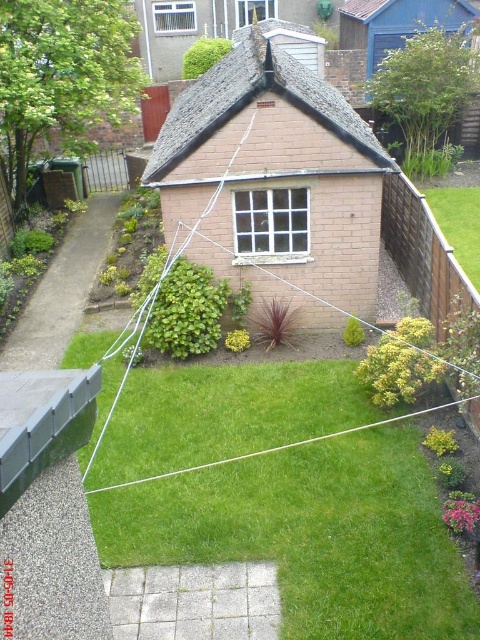
Describe the element at coordinates (312, 534) in the screenshot. I see `green grass at center` at that location.

Can you confirm if green grass at center is smaller than green grass at right?

No.

I want to click on green grass at center, so click(x=312, y=534).